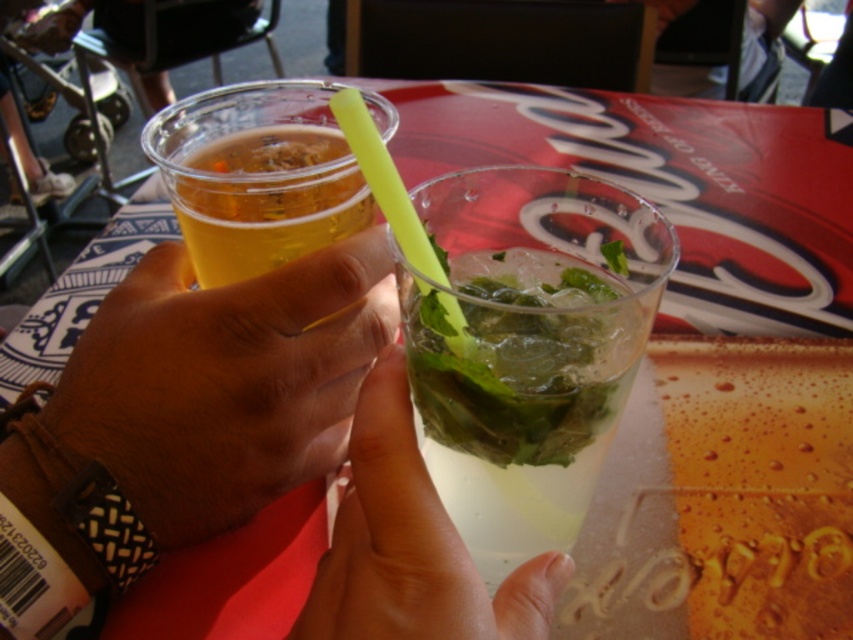
Question: Does smooth skin hand at center have a greater width compared to translucent plastic cup at center?

Choices:
 (A) yes
 (B) no

Answer: (A)

Question: Which point is farther to the camera?

Choices:
 (A) translucent glass at center
 (B) translucent plastic cup at center
 (C) smooth skin hand at center

Answer: (B)

Question: Which point is farther from the camera taking this photo?

Choices:
 (A) (468, 586)
 (B) (321, 176)

Answer: (B)

Question: In this image, where is smooth skin hand at center located relative to translucent glass at center?

Choices:
 (A) left
 (B) right

Answer: (A)

Question: Which of the following is the farthest from the observer?

Choices:
 (A) (291, 467)
 (B) (463, 548)

Answer: (A)

Question: Is translucent glass at center thinner than translucent plastic cup at center?

Choices:
 (A) yes
 (B) no

Answer: (A)